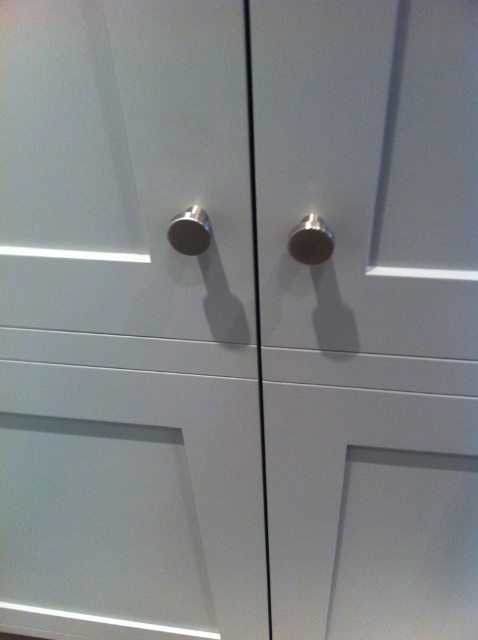
Question: Based on their relative distances, which object is farther from the satin nickel knob at center?

Choices:
 (A) metallic silver knob at center
 (B) polished silver knob at center

Answer: (A)

Question: Among these points, which one is nearest to the camera?

Choices:
 (A) (189, 205)
 (B) (313, 228)

Answer: (B)

Question: Can you confirm if polished silver knob at center is thinner than satin nickel knob at center?

Choices:
 (A) no
 (B) yes

Answer: (B)

Question: Which point is farther from the camera taking this photo?

Choices:
 (A) (192, 209)
 (B) (297, 257)

Answer: (A)

Question: Does metallic silver knob at center appear over satin nickel knob at center?

Choices:
 (A) yes
 (B) no

Answer: (B)

Question: Does metallic silver knob at center have a greater width compared to satin nickel knob at center?

Choices:
 (A) yes
 (B) no

Answer: (A)